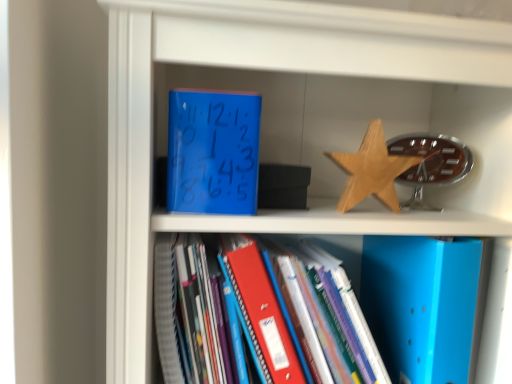
Question: Is blue matte folder at center a part of blue matte clock at upper center, the first paperback book from the top?

Choices:
 (A) yes
 (B) no

Answer: (B)

Question: From a real-world perspective, does blue matte clock at upper center, which is the 1th paperback book in left-to-right order, sit lower than blue matte folder at center?

Choices:
 (A) no
 (B) yes

Answer: (A)

Question: Is blue matte clock at upper center, the first paperback book from the top, thinner than blue matte folder at center?

Choices:
 (A) yes
 (B) no

Answer: (A)

Question: Are blue matte clock at upper center, placed as the second paperback book when sorted from bottom to top, and blue matte folder at center far apart?

Choices:
 (A) no
 (B) yes

Answer: (A)

Question: From the image's perspective, would you say blue matte clock at upper center, placed as the second paperback book when sorted from bottom to top, is shown under blue matte folder at center?

Choices:
 (A) yes
 (B) no

Answer: (B)

Question: In the image, is blue matte folder at center positioned in front of or behind blue matte clock at upper center, which is the 1th paperback book in left-to-right order?

Choices:
 (A) front
 (B) behind

Answer: (A)

Question: Choose the correct answer: Is blue matte folder at center inside blue matte clock at upper center, placed as the second paperback book when sorted from bottom to top, or outside it?

Choices:
 (A) outside
 (B) inside

Answer: (A)

Question: From a real-world perspective, is blue matte folder at center physically located above or below blue matte clock at upper center, the second paperback book in the right-to-left sequence?

Choices:
 (A) below
 (B) above

Answer: (A)

Question: Is point (339, 332) closer or farther from the camera than point (248, 132)?

Choices:
 (A) closer
 (B) farther

Answer: (B)

Question: Visually, is blue matte folder at center positioned to the left or to the right of wooden star at upper right?

Choices:
 (A) left
 (B) right

Answer: (A)

Question: Is blue matte folder at center taller or shorter than wooden star at upper right?

Choices:
 (A) short
 (B) tall

Answer: (B)

Question: Considering the positions of blue matte folder at center and wooden star at upper right in the image, is blue matte folder at center bigger or smaller than wooden star at upper right?

Choices:
 (A) big
 (B) small

Answer: (A)

Question: From a real-world perspective, relative to wooden star at upper right, is blue matte folder at center vertically above or below?

Choices:
 (A) above
 (B) below

Answer: (B)

Question: Which is correct: wooden star at upper right is inside blue matte clock at upper center, the second paperback book in the right-to-left sequence, or outside of it?

Choices:
 (A) inside
 (B) outside

Answer: (B)

Question: In the image, is wooden star at upper right positioned in front of or behind blue matte clock at upper center, which is the 1th paperback book in left-to-right order?

Choices:
 (A) behind
 (B) front

Answer: (A)